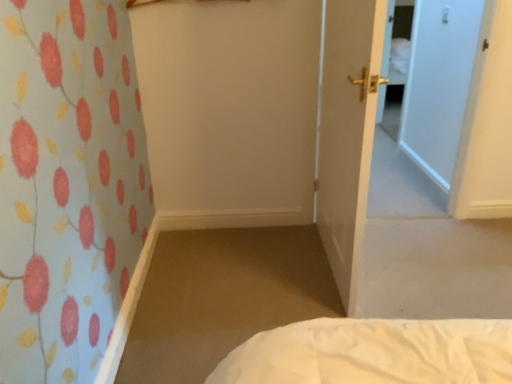
At what (x,y) coordinates should I click in order to perform the action: click on blank space to the left of gold metallic door handle at center. Please return your answer as a coordinate pair (x, y). The image size is (512, 384). Looking at the image, I should click on (243, 265).